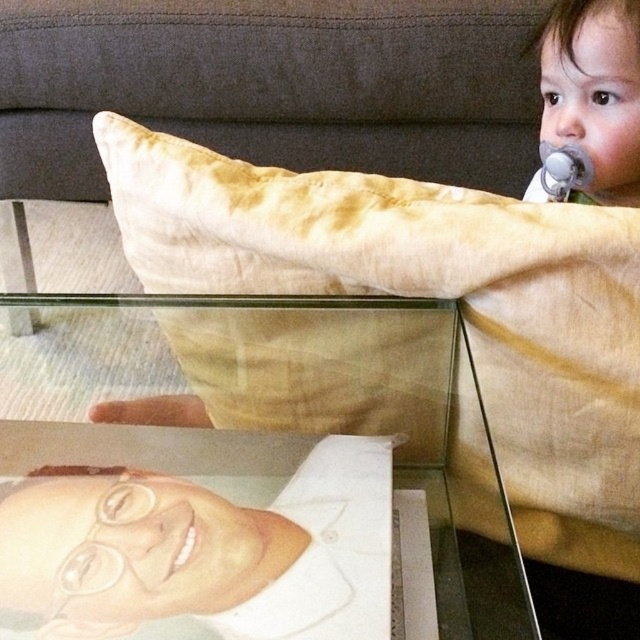
Question: Is transparent glass portrait at lower left thinner than white matte mouth at lower center?

Choices:
 (A) no
 (B) yes

Answer: (A)

Question: Which object appears closest to the camera in this image?

Choices:
 (A) smooth skin toddler at upper right
 (B) white matte mouth at lower center
 (C) transparent glass portrait at lower left

Answer: (C)

Question: Based on their relative distances, which object is nearer to the transparent glass portrait at lower left?

Choices:
 (A) beige cotton pillow at upper center
 (B) smooth skin toddler at upper right
 (C) white matte mouth at lower center

Answer: (A)

Question: Is beige cotton pillow at upper center behind smooth skin toddler at upper right?

Choices:
 (A) no
 (B) yes

Answer: (A)

Question: Which object appears farthest from the camera in this image?

Choices:
 (A) white matte mouth at lower center
 (B) beige cotton pillow at upper center

Answer: (A)

Question: Does smooth skin toddler at upper right appear under white matte mouth at lower center?

Choices:
 (A) yes
 (B) no

Answer: (B)